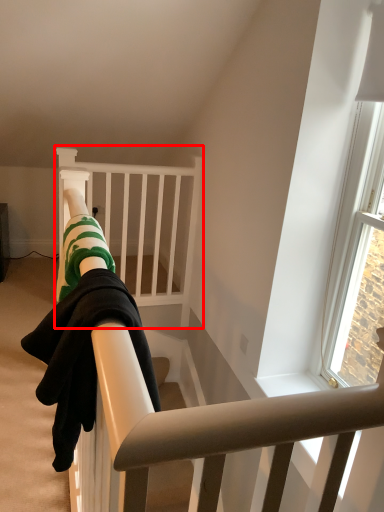
Question: From the image's perspective, where is infant bed (annotated by the red box) located in relation to person in the image?

Choices:
 (A) above
 (B) below

Answer: (A)